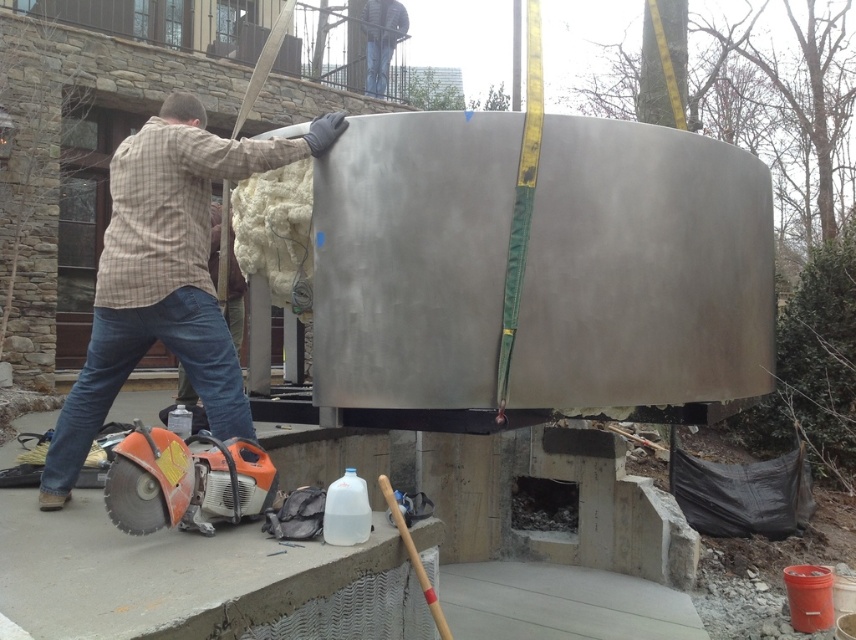
Where is the plaid shirt at left located in the image?

The plaid shirt at left is located at point (165, 275) in the image.

You are a construction worker standing near the orange plastic circular saw at lower left and need to hand a tool to a colleague wearing the plaid shirt at left. Which direction should you move to reach them?

The plaid shirt at left is further to the viewer than the orange plastic circular saw at lower left, so you should move forward towards the plaid shirt at left to reach them.